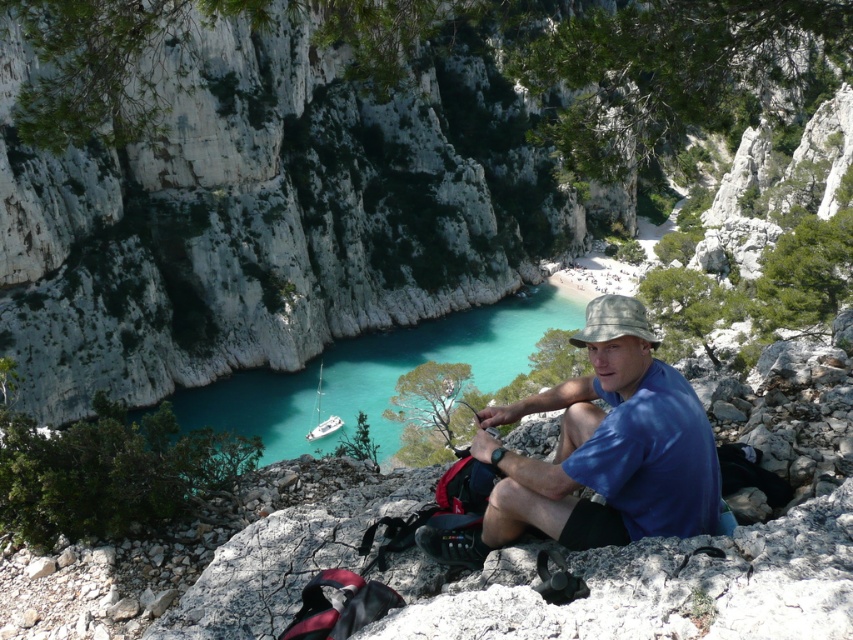
You are navigating a drone through the scene and need to fly from point A to point B. Point A is at coordinates point (x=611, y=376) and point B is at coordinates point (x=633, y=323). Given that the drone can only move forward and cannot reverse, which direction should you steer the drone to reach point B from point A?

Since point (x=611, y=376) is behind point (x=633, y=323), you should steer the drone forward in the direction opposite to its current orientation to reach point B from point A.

You are a photographer trying to capture a clear shot of the blue cotton shirt at center and the camouflage fabric baseball hat at center. Which object should you focus on first to ensure both are in focus?

The blue cotton shirt at center is in front of the camouflage fabric baseball hat at center, so you should focus on the blue cotton shirt at center first to ensure both are in focus.